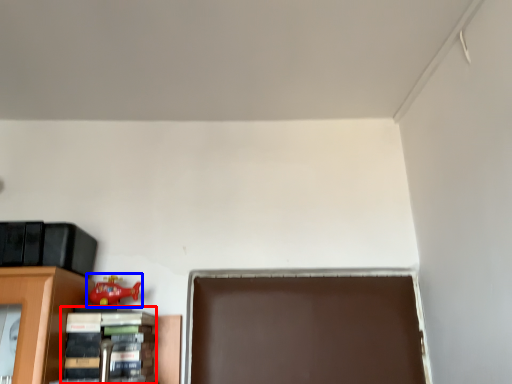
Question: Which object appears farthest to the camera in this image, book (highlighted by a red box) or toy (highlighted by a blue box)?

Choices:
 (A) book
 (B) toy

Answer: (B)